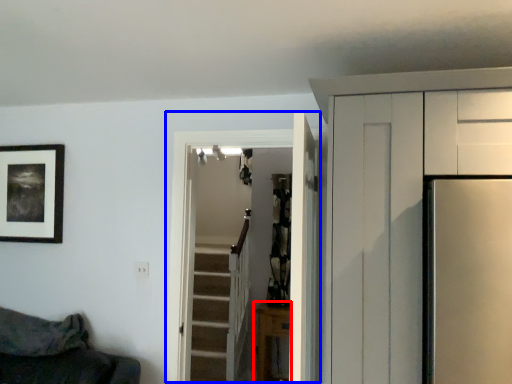
Question: Which object is further to the camera taking this photo, furniture (highlighted by a red box) or door (highlighted by a blue box)?

Choices:
 (A) furniture
 (B) door

Answer: (A)